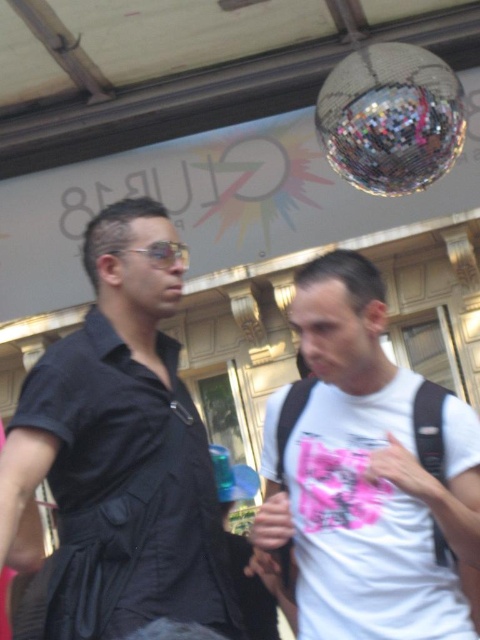
Question: Estimate the real-world distances between objects in this image. Which object is farther from the reflective metallic disco ball at upper center?

Choices:
 (A) black matte shirt at left
 (B) white matte t-shirt at center

Answer: (A)

Question: Is the position of black matte shirt at left less distant than that of white matte t-shirt at center?

Choices:
 (A) no
 (B) yes

Answer: (B)

Question: Does white matte t-shirt at center appear under reflective metallic disco ball at upper center?

Choices:
 (A) yes
 (B) no

Answer: (A)

Question: Considering the real-world distances, which object is closest to the black matte shirt at left?

Choices:
 (A) reflective metallic disco ball at upper center
 (B) white matte t-shirt at center

Answer: (B)

Question: Is white matte t-shirt at center to the right of reflective metallic disco ball at upper center from the viewer's perspective?

Choices:
 (A) yes
 (B) no

Answer: (B)

Question: Which point is farther from the camera taking this photo?

Choices:
 (A) (165, 308)
 (B) (312, 310)
 (C) (430, 92)

Answer: (C)